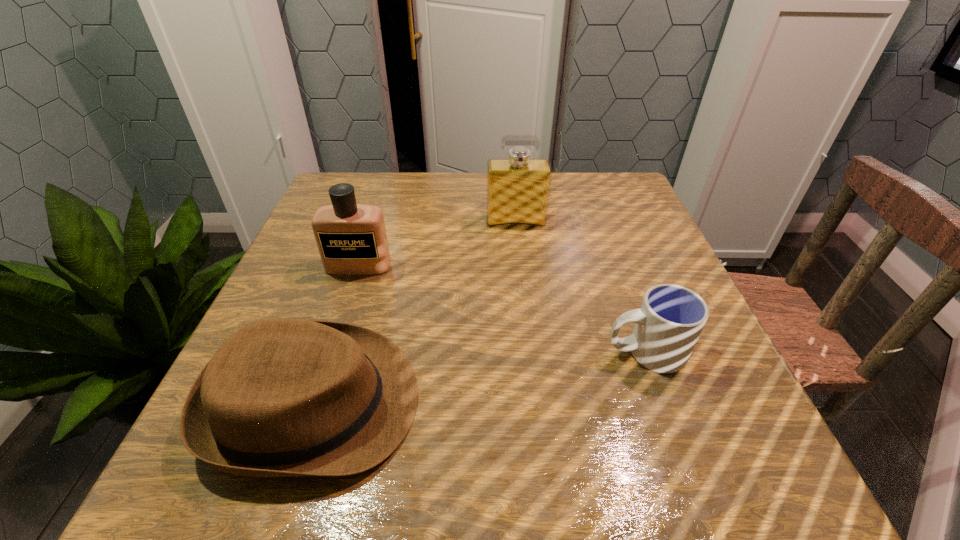
This screenshot has width=960, height=540. I want to click on vacant area situated with the handle on the side of the cup, so pyautogui.click(x=449, y=352).

The width and height of the screenshot is (960, 540). In order to click on free space located 0.170m on the front-facing side of the fedora in this screenshot , I will do `click(527, 403)`.

Locate an element on the screen. Image resolution: width=960 pixels, height=540 pixels. object present at the far edge is located at coordinates (518, 187).

Find the location of a particular element. object that is at the near edge is located at coordinates (284, 397).

Locate an element on the screen. The image size is (960, 540). perfume that is at the left edge is located at coordinates click(x=351, y=238).

Where is `fedora that is positioned at the left edge`? fedora that is positioned at the left edge is located at coordinates (284, 397).

This screenshot has width=960, height=540. Identify the location of object at the right edge. (667, 326).

The height and width of the screenshot is (540, 960). Identify the location of object at the near left corner. coord(284,397).

The height and width of the screenshot is (540, 960). In the image, there is a desktop. Identify the location of free space at the far edge. (567, 192).

The width and height of the screenshot is (960, 540). In order to click on blank space at the left edge in this screenshot , I will do `click(289, 268)`.